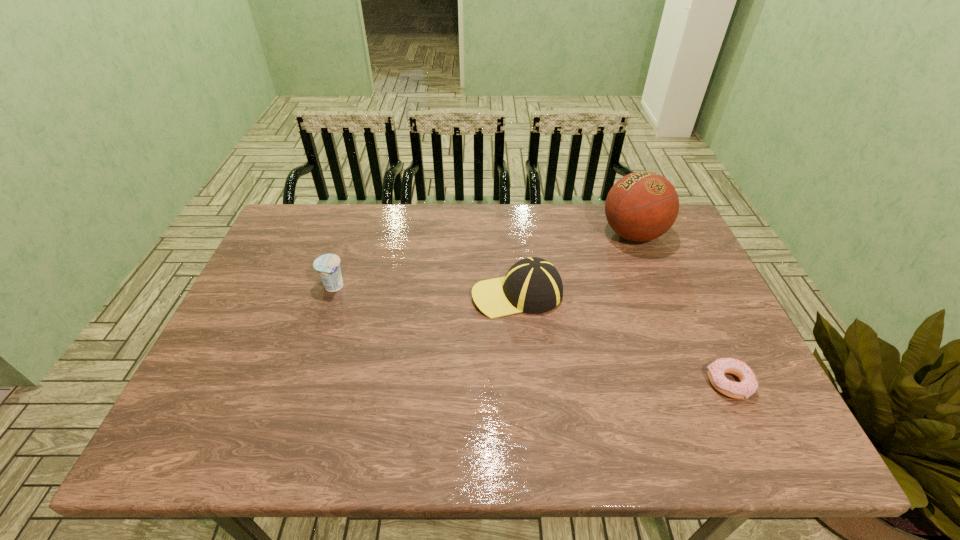
Where is `the farthest object`? Image resolution: width=960 pixels, height=540 pixels. the farthest object is located at coordinates (641, 206).

You are a GUI agent. You are given a task and a screenshot of the screen. Output one action in this format:
    pyautogui.click(x=<x>, y=<y>)
    Task: Click on the basketball
    The width and height of the screenshot is (960, 540).
    Given the screenshot: What is the action you would take?
    pyautogui.click(x=641, y=206)

Locate an element on the screen. the third object from right to left is located at coordinates (533, 285).

This screenshot has width=960, height=540. I want to click on baseball cap, so click(533, 285).

Find the location of a particular element. This screenshot has width=960, height=540. yogurt is located at coordinates (328, 265).

You are a GUI agent. You are given a task and a screenshot of the screen. Output one action in this format:
    pyautogui.click(x=<x>, y=<y>)
    Task: Click on the leftmost object
    
    Given the screenshot: What is the action you would take?
    pyautogui.click(x=328, y=265)

Locate an element on the screen. the nearest object is located at coordinates (748, 384).

Identify the location of doughnut. The image size is (960, 540). (748, 384).

The width and height of the screenshot is (960, 540). What are the coordinates of `vacant space located on the front of the farthest object` in the screenshot? It's located at (673, 334).

Identify the location of blank space located with the brim of the baseball cap facing forward. (407, 294).